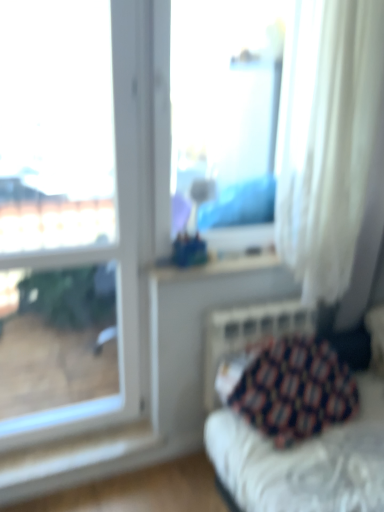
Question: Which direction should I rotate to look at transparent glass vase at center, marked as the second window in a left-to-right arrangement?

Choices:
 (A) right
 (B) left

Answer: (B)

Question: Is patterned fabric cushion at lower right bigger than transparent glass window at upper left, which is the first window from left to right?

Choices:
 (A) yes
 (B) no

Answer: (A)

Question: Considering the relative sizes of patterned fabric cushion at lower right and transparent glass window at upper left, which is counted as the second window, starting from the right, in the image provided, is patterned fabric cushion at lower right thinner than transparent glass window at upper left, which is counted as the second window, starting from the right,?

Choices:
 (A) yes
 (B) no

Answer: (B)

Question: Is patterned fabric cushion at lower right in front of transparent glass window at upper left, which is counted as the second window, starting from the right?

Choices:
 (A) yes
 (B) no

Answer: (B)

Question: Does patterned fabric cushion at lower right turn towards transparent glass window at upper left, which is the first window from left to right?

Choices:
 (A) yes
 (B) no

Answer: (B)

Question: Can you confirm if patterned fabric cushion at lower right is taller than transparent glass window at upper left, which is the first window from left to right?

Choices:
 (A) no
 (B) yes

Answer: (A)

Question: Does patterned fabric cushion at lower right have a smaller size compared to transparent glass window at upper left, which is the first window from left to right?

Choices:
 (A) no
 (B) yes

Answer: (A)

Question: Is metallic silver radiator at lower right positioned with its back to white sheer curtain at right?

Choices:
 (A) yes
 (B) no

Answer: (B)

Question: From a real-world perspective, is metallic silver radiator at lower right positioned over white sheer curtain at right based on gravity?

Choices:
 (A) yes
 (B) no

Answer: (B)

Question: From a real-world perspective, is metallic silver radiator at lower right physically below white sheer curtain at right?

Choices:
 (A) yes
 (B) no

Answer: (A)

Question: Is metallic silver radiator at lower right bigger than white sheer curtain at right?

Choices:
 (A) yes
 (B) no

Answer: (B)

Question: Can you confirm if metallic silver radiator at lower right is positioned to the left of white sheer curtain at right?

Choices:
 (A) no
 (B) yes

Answer: (B)

Question: Is metallic silver radiator at lower right taller than white sheer curtain at right?

Choices:
 (A) no
 (B) yes

Answer: (A)

Question: Considering the relative sizes of white sheer curtain at right and transparent glass window at upper left, which is the first window from left to right, in the image provided, is white sheer curtain at right shorter than transparent glass window at upper left, which is the first window from left to right,?

Choices:
 (A) yes
 (B) no

Answer: (A)